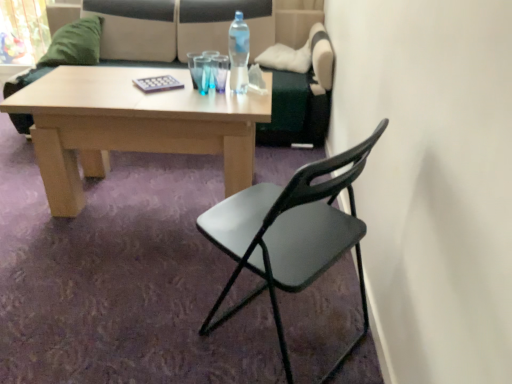
Question: Is the surface of green fuzzy pillow at upper left in direct contact with transparent glass at center?

Choices:
 (A) yes
 (B) no

Answer: (B)

Question: Considering the relative sizes of green fuzzy pillow at upper left and transparent glass at center in the image provided, is green fuzzy pillow at upper left shorter than transparent glass at center?

Choices:
 (A) no
 (B) yes

Answer: (A)

Question: Can you confirm if green fuzzy pillow at upper left is smaller than transparent glass at center?

Choices:
 (A) no
 (B) yes

Answer: (A)

Question: Is green fuzzy pillow at upper left to the right of transparent glass at center from the viewer's perspective?

Choices:
 (A) yes
 (B) no

Answer: (B)

Question: Is green fuzzy pillow at upper left positioned before transparent glass at center?

Choices:
 (A) yes
 (B) no

Answer: (B)

Question: Is transparent glass at center at the back of green fuzzy pillow at upper left?

Choices:
 (A) no
 (B) yes

Answer: (A)

Question: Is transparent glass at center positioned beyond the bounds of clear plastic bottle at center?

Choices:
 (A) yes
 (B) no

Answer: (A)

Question: Is transparent glass at center further to the viewer compared to clear plastic bottle at center?

Choices:
 (A) yes
 (B) no

Answer: (A)

Question: From a real-world perspective, is transparent glass at center under clear plastic bottle at center?

Choices:
 (A) no
 (B) yes

Answer: (B)

Question: Is transparent glass at center not close to clear plastic bottle at center?

Choices:
 (A) no
 (B) yes

Answer: (A)

Question: Is transparent glass at center wider than clear plastic bottle at center?

Choices:
 (A) no
 (B) yes

Answer: (B)

Question: Is transparent glass at center at the right side of clear plastic bottle at center?

Choices:
 (A) no
 (B) yes

Answer: (A)

Question: Considering the relative sizes of black plastic chair at center and green fuzzy pillow at upper left in the image provided, is black plastic chair at center taller than green fuzzy pillow at upper left?

Choices:
 (A) yes
 (B) no

Answer: (A)